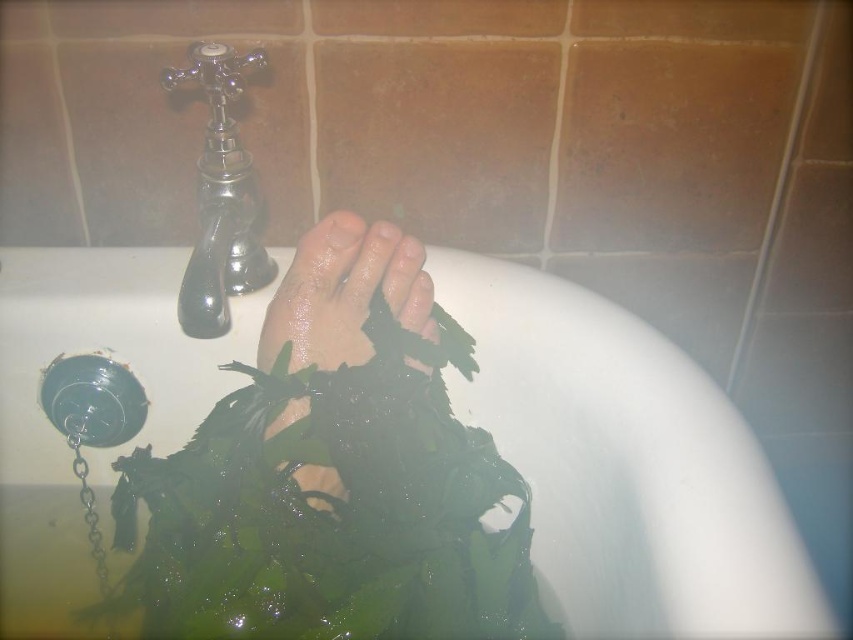
Is slick skin foot at center further to the viewer compared to chrome/metallic faucet at upper left?

That is False.

Is slick skin foot at center shorter than chrome/metallic faucet at upper left?

Indeed, slick skin foot at center has a lesser height compared to chrome/metallic faucet at upper left.

What are the coordinates of `slick skin foot at center` in the screenshot? It's located at (344, 292).

This screenshot has height=640, width=853. What do you see at coordinates (625, 461) in the screenshot?
I see `green leafy plant at center` at bounding box center [625, 461].

Does green leafy plant at center have a lesser height compared to slick skin foot at center?

No.

Locate an element on the screen. green leafy plant at center is located at coordinates (625, 461).

Between green leafy plant at center and chrome/metallic faucet at upper left, which one has less height?

chrome/metallic faucet at upper left

Looking at this image, can you confirm if green leafy plant at center is wider than chrome/metallic faucet at upper left?

Indeed, green leafy plant at center has a greater width compared to chrome/metallic faucet at upper left.

Where is `green leafy plant at center`? green leafy plant at center is located at coordinates (625, 461).

Where is `green leafy plant at center`? Image resolution: width=853 pixels, height=640 pixels. green leafy plant at center is located at coordinates (625, 461).